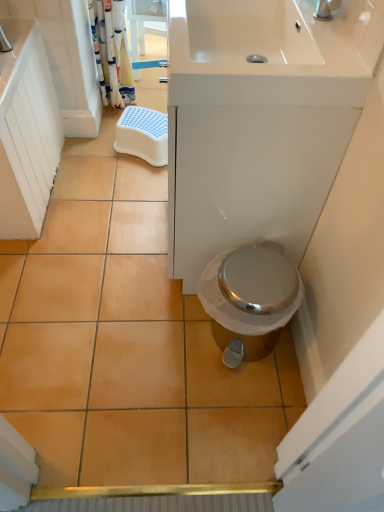
Question: Is point (172, 94) closer or farther from the camera than point (144, 117)?

Choices:
 (A) closer
 (B) farther

Answer: (A)

Question: From their relative heights in the image, would you say white glossy sink at upper center is taller or shorter than white plastic step stool at center?

Choices:
 (A) tall
 (B) short

Answer: (B)

Question: Based on their relative distances, which object is nearer to the white glossy sink at upper center?

Choices:
 (A) white fabric shower curtain at upper left
 (B) white plastic step stool at center

Answer: (B)

Question: Which object is the closest to the white plastic step stool at center?

Choices:
 (A) white fabric shower curtain at upper left
 (B) white glossy sink at upper center

Answer: (A)